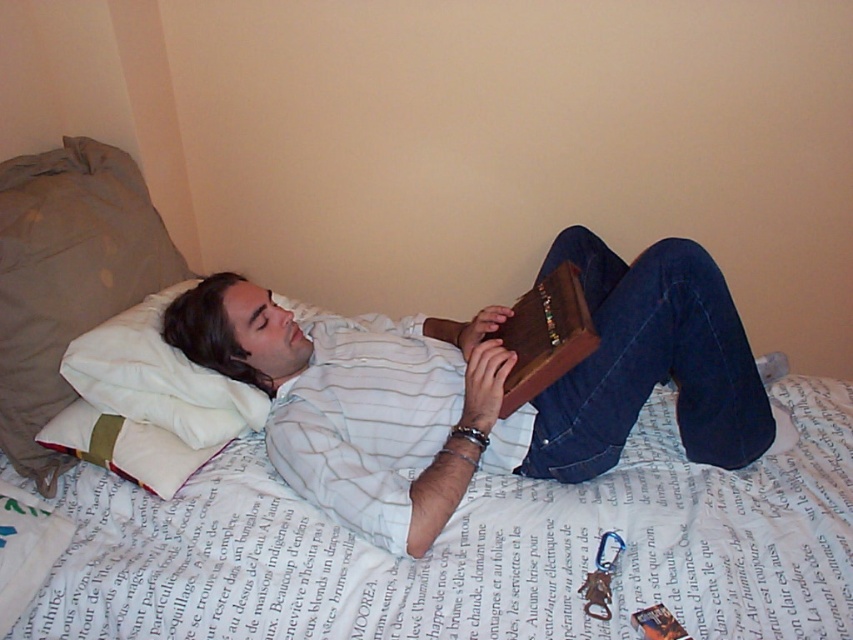
Question: Which point is closer to the camera?

Choices:
 (A) (84, 348)
 (B) (271, 316)

Answer: (A)

Question: Which of the following is the closest to the observer?

Choices:
 (A) white soft pillow at upper left
 (B) matte brown book at center

Answer: (B)

Question: In this image, where is matte brown book at center located relative to white soft pillow at upper left?

Choices:
 (A) above
 (B) below

Answer: (B)

Question: Is matte brown book at center bigger than white soft pillow at upper left?

Choices:
 (A) no
 (B) yes

Answer: (B)

Question: Which object is farther from the camera taking this photo?

Choices:
 (A) matte brown book at center
 (B) white soft pillow at upper left

Answer: (B)

Question: In this image, where is matte brown book at center located relative to white soft pillow at upper left?

Choices:
 (A) left
 (B) right

Answer: (B)